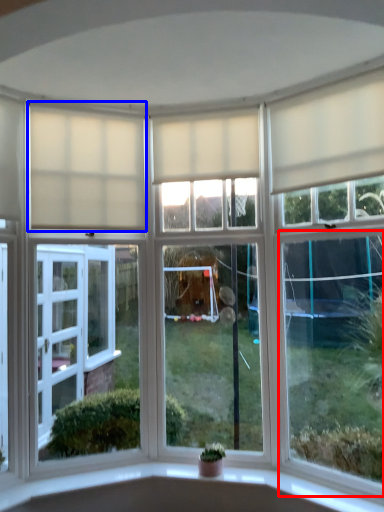
Question: Which point is closer to the camera, window (highlighted by a red box) or curtain (highlighted by a blue box)?

Choices:
 (A) window
 (B) curtain

Answer: (A)